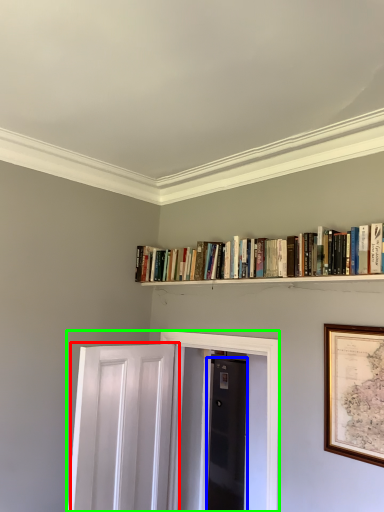
Question: Which object is positioned closest to door (highlighted by a red box)? Select from door (highlighted by a blue box) and elevator (highlighted by a green box).

Choices:
 (A) door
 (B) elevator

Answer: (B)